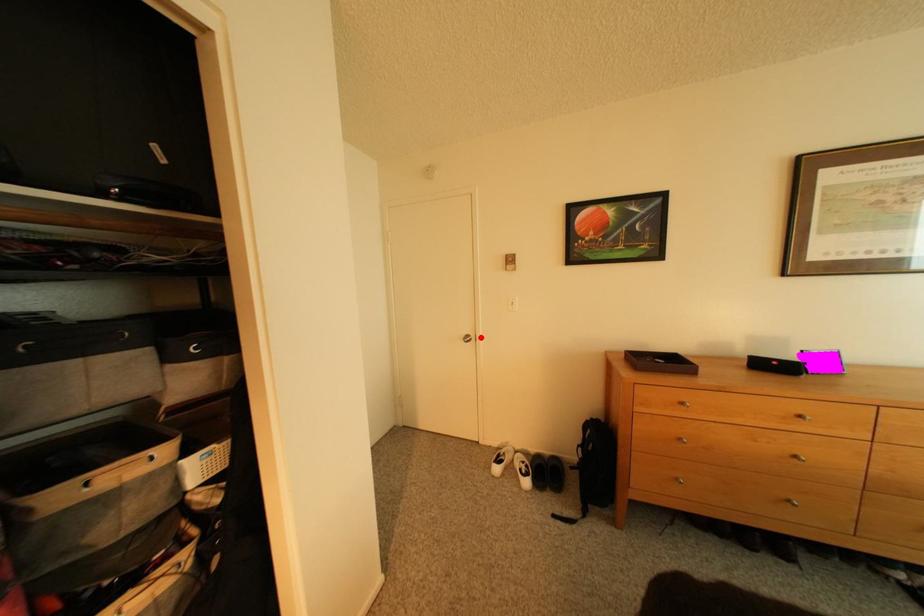
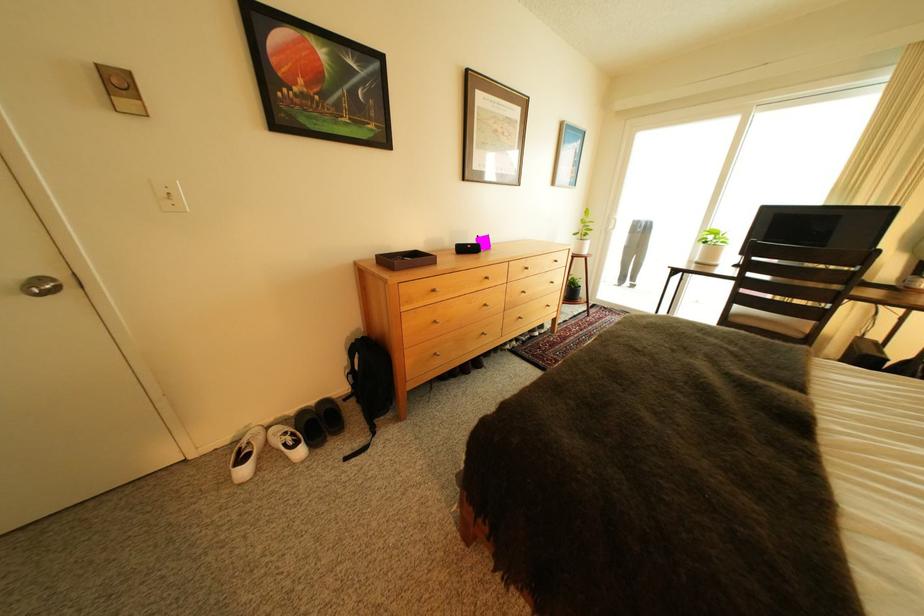
In the second image, find the point that corresponds to the highlighted location in the first image.

(55, 281)